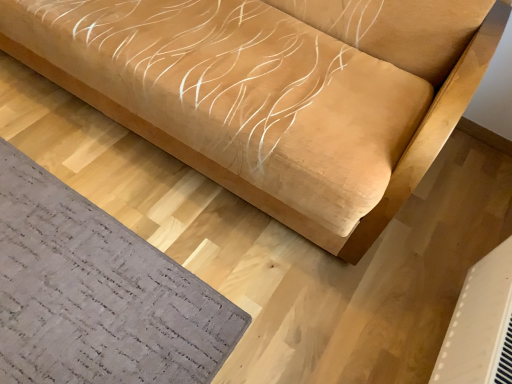
Question: Is suede-like beige sofa at upper center at the left side of white plastic air conditioning unit at lower right?

Choices:
 (A) no
 (B) yes

Answer: (B)

Question: Is suede-like beige sofa at upper center thinner than white plastic air conditioning unit at lower right?

Choices:
 (A) yes
 (B) no

Answer: (B)

Question: Would you say suede-like beige sofa at upper center is outside white plastic air conditioning unit at lower right?

Choices:
 (A) yes
 (B) no

Answer: (A)

Question: Does suede-like beige sofa at upper center have a greater width compared to white plastic air conditioning unit at lower right?

Choices:
 (A) no
 (B) yes

Answer: (B)

Question: Is suede-like beige sofa at upper center taller than white plastic air conditioning unit at lower right?

Choices:
 (A) yes
 (B) no

Answer: (A)

Question: Considering the relative sizes of suede-like beige sofa at upper center and white plastic air conditioning unit at lower right in the image provided, is suede-like beige sofa at upper center bigger than white plastic air conditioning unit at lower right?

Choices:
 (A) yes
 (B) no

Answer: (A)

Question: Can you confirm if gray textured mat at lower left is bigger than white plastic air conditioning unit at lower right?

Choices:
 (A) yes
 (B) no

Answer: (B)

Question: Is gray textured mat at lower left outside of white plastic air conditioning unit at lower right?

Choices:
 (A) yes
 (B) no

Answer: (A)

Question: Is gray textured mat at lower left far away from white plastic air conditioning unit at lower right?

Choices:
 (A) no
 (B) yes

Answer: (A)

Question: Does gray textured mat at lower left have a lesser width compared to white plastic air conditioning unit at lower right?

Choices:
 (A) no
 (B) yes

Answer: (A)

Question: Is gray textured mat at lower left positioned with its back to white plastic air conditioning unit at lower right?

Choices:
 (A) yes
 (B) no

Answer: (B)

Question: Is gray textured mat at lower left to the left of white plastic air conditioning unit at lower right from the viewer's perspective?

Choices:
 (A) yes
 (B) no

Answer: (A)

Question: Is the depth of white plastic air conditioning unit at lower right less than that of gray textured mat at lower left?

Choices:
 (A) yes
 (B) no

Answer: (A)